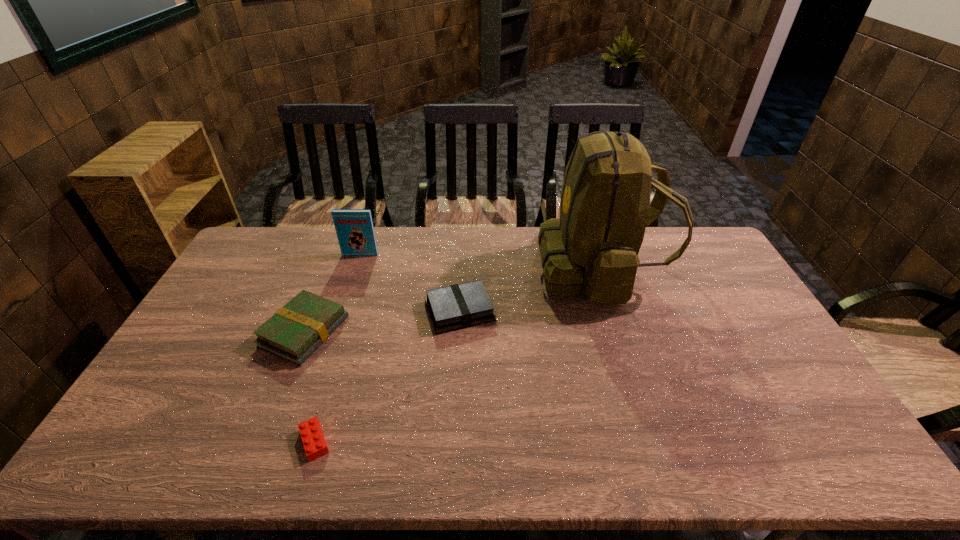
Identify the location of vacant space at the far left corner. (298, 228).

Locate an element on the screen. free point at the far right corner is located at coordinates (711, 242).

At what (x,y) coordinates should I click in order to perform the action: click on vacant space at the near right corner. Please return your answer as a coordinate pair (x, y). Image resolution: width=960 pixels, height=540 pixels. Looking at the image, I should click on (838, 455).

You are a GUI agent. You are given a task and a screenshot of the screen. Output one action in this format:
    pyautogui.click(x=<x>, y=<y>)
    Task: Click on the blank region between the backpack and the nearest object
    
    Given the screenshot: What is the action you would take?
    pyautogui.click(x=457, y=355)

The width and height of the screenshot is (960, 540). In order to click on free space that is in between the tallest object and the nearest object in this screenshot , I will do `click(457, 355)`.

Find the location of `unoccupied position between the fourth object from left to right and the tallest object`. unoccupied position between the fourth object from left to right and the tallest object is located at coordinates (530, 289).

Image resolution: width=960 pixels, height=540 pixels. Identify the location of vacant point located between the nearest object and the tallest book. (338, 348).

Find the location of a particular element. unoccupied area between the farthest book and the shortest object is located at coordinates (338, 348).

Locate an element on the screen. The width and height of the screenshot is (960, 540). vacant region between the farthest book and the rightmost book is located at coordinates (410, 283).

Identify the location of free spot between the farthest book and the nearest object. (338, 348).